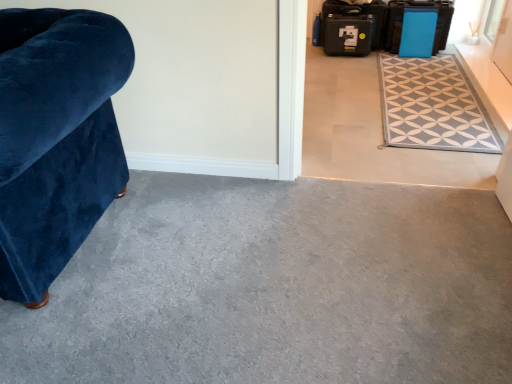
In order to face blue matte suitcase at upper right, which is the 2th luggage from left to right, should I rotate leftwards or rightwards?

You should look right and rotate roughly 20.894 degrees.

Describe the element at coordinates (418, 32) in the screenshot. I see `blue matte suitcase at upper right, which is the 2th luggage from left to right` at that location.

Locate an element on the screen. The image size is (512, 384). velvet blue armchair at left is located at coordinates (56, 139).

Describe the element at coordinates (56, 139) in the screenshot. I see `velvet blue armchair at left` at that location.

Image resolution: width=512 pixels, height=384 pixels. What do you see at coordinates (347, 34) in the screenshot?
I see `black plastic suitcase at upper right, the first luggage in the left-to-right sequence` at bounding box center [347, 34].

The image size is (512, 384). I want to click on gray carpet at lower left, which is counted as the 2th concrete, starting from the top, so click(276, 288).

This screenshot has width=512, height=384. Find the location of `gray tile floor at center, the 2th concrete in the front-to-back sequence`. gray tile floor at center, the 2th concrete in the front-to-back sequence is located at coordinates (369, 130).

This screenshot has width=512, height=384. What do you see at coordinates (369, 130) in the screenshot?
I see `gray tile floor at center, the 1th concrete from the back` at bounding box center [369, 130].

Locate an element on the screen. This screenshot has width=512, height=384. blue matte suitcase at upper right, placed as the second luggage when sorted from right to left is located at coordinates (418, 32).

Who is taller, blue matte suitcase at upper right, which is the 2th luggage from left to right, or gray tile floor at center, the 1th concrete from the back?

Standing taller between the two is blue matte suitcase at upper right, which is the 2th luggage from left to right.

From the image's perspective, is blue matte suitcase at upper right, placed as the second luggage when sorted from right to left, over gray tile floor at center, placed as the 1th concrete when sorted from top to bottom?

Correct, blue matte suitcase at upper right, placed as the second luggage when sorted from right to left, appears higher than gray tile floor at center, placed as the 1th concrete when sorted from top to bottom, in the image.

Considering the relative positions of blue matte suitcase at upper right, placed as the second luggage when sorted from right to left, and gray tile floor at center, placed as the 1th concrete when sorted from top to bottom, in the image provided, is blue matte suitcase at upper right, placed as the second luggage when sorted from right to left, behind gray tile floor at center, placed as the 1th concrete when sorted from top to bottom,?

Yes, it is behind gray tile floor at center, placed as the 1th concrete when sorted from top to bottom.

In the scene shown: How different are the orientations of black plastic suitcase at upper right, the first luggage in the left-to-right sequence, and blue matte suitcase at upper right, which is the 2th luggage from left to right, in degrees?

They differ by 0.978 degrees in their facing directions.

Is point (342, 27) positioned after point (407, 7)?

Yes.

Is black plastic suitcase at upper right, which is the 3th luggage from right to left, turned away from blue matte suitcase at upper right, which is the 2th luggage from left to right?

No, blue matte suitcase at upper right, which is the 2th luggage from left to right, is not at the back of black plastic suitcase at upper right, which is the 3th luggage from right to left.

Considering the relative positions of black plastic suitcase at upper right, the first luggage in the left-to-right sequence, and blue matte suitcase at upper right, placed as the second luggage when sorted from right to left, in the image provided, is black plastic suitcase at upper right, the first luggage in the left-to-right sequence, to the left or to the right of blue matte suitcase at upper right, placed as the second luggage when sorted from right to left,?

black plastic suitcase at upper right, the first luggage in the left-to-right sequence, is positioned on blue matte suitcase at upper right, placed as the second luggage when sorted from right to left,'s left side.

Can you tell me how much gray carpet at lower left, which appears as the 2th concrete when viewed from the back, and velvet blue armchair at left differ in facing direction?

They differ by 180 degrees in their facing directions.

From a real-world perspective, between gray carpet at lower left, which is counted as the 2th concrete, starting from the top, and velvet blue armchair at left, who is vertically lower?

gray carpet at lower left, which is counted as the 2th concrete, starting from the top.

Are gray carpet at lower left, which is counted as the 1th concrete, starting from the bottom, and velvet blue armchair at left located far from each other?

They are positioned close to each other.

Is the depth of gray carpet at lower left, which is counted as the 1th concrete, starting from the bottom, less than that of velvet blue armchair at left?

That is False.

Is gray tile floor at center, the 1th concrete from the back, not near black plastic suitcase at upper right, the first luggage in the left-to-right sequence?

No, gray tile floor at center, the 1th concrete from the back, is in close proximity to black plastic suitcase at upper right, the first luggage in the left-to-right sequence.

Based on their sizes in the image, would you say gray tile floor at center, the 2th concrete in the front-to-back sequence, is bigger or smaller than black plastic suitcase at upper right, which is the 3th luggage from right to left?

Clearly, gray tile floor at center, the 2th concrete in the front-to-back sequence, is larger in size than black plastic suitcase at upper right, which is the 3th luggage from right to left.

Visually, is gray tile floor at center, the 1th concrete from the back, positioned to the left or to the right of black plastic suitcase at upper right, which is the 3th luggage from right to left?

From the image, it's evident that gray tile floor at center, the 1th concrete from the back, is to the right of black plastic suitcase at upper right, which is the 3th luggage from right to left.

From the image's perspective, is gray tile floor at center, the 2th concrete in the front-to-back sequence, over black plastic suitcase at upper right, the first luggage in the left-to-right sequence?

No.

From the image's perspective, does black plastic suitcase at upper right, the first luggage in the left-to-right sequence, appear higher than gray fabric rug at upper right?

Yes, from the image's perspective, black plastic suitcase at upper right, the first luggage in the left-to-right sequence, is on top of gray fabric rug at upper right.

Is black plastic suitcase at upper right, which is the 3th luggage from right to left, positioned beyond the bounds of gray fabric rug at upper right?

Indeed, black plastic suitcase at upper right, which is the 3th luggage from right to left, is completely outside gray fabric rug at upper right.

Can you tell me how much black plastic suitcase at upper right, which is the 3th luggage from right to left, and gray fabric rug at upper right differ in facing direction?

They differ by 89.8 degrees in their facing directions.

Can you see black plastic suitcase at upper right, which is the 3th luggage from right to left, touching gray fabric rug at upper right?

No, black plastic suitcase at upper right, which is the 3th luggage from right to left, is not making contact with gray fabric rug at upper right.

Which object is further away from the camera, gray carpet at lower left, which appears as the 2th concrete when viewed from the back, or gray fabric rug at upper right?

gray fabric rug at upper right is further from the camera.

Is gray carpet at lower left, which is counted as the 2th concrete, starting from the top, turned away from gray fabric rug at upper right?

No, gray fabric rug at upper right is not at the back of gray carpet at lower left, which is counted as the 2th concrete, starting from the top.

From a real-world perspective, who is located higher, gray carpet at lower left, which appears as the 2th concrete when viewed from the back, or gray fabric rug at upper right?

From a 3D spatial view, gray fabric rug at upper right is above.

Considering the relative sizes of gray carpet at lower left, the first concrete viewed from the front, and gray fabric rug at upper right in the image provided, is gray carpet at lower left, the first concrete viewed from the front, taller than gray fabric rug at upper right?

Correct, gray carpet at lower left, the first concrete viewed from the front, is much taller as gray fabric rug at upper right.

Which luggage is the 1st one when counting from the back of the blue matte suitcase at upper right, placed as the second luggage when sorted from right to left? Please provide its 2D coordinates.

[(402, 22)]

Considering the sizes of objects blue matte suitcase at upper right, which is the 2th luggage from left to right, and blue plastic suitcase at upper right, positioned as the 1th luggage in right-to-left order, in the image provided, who is wider, blue matte suitcase at upper right, which is the 2th luggage from left to right, or blue plastic suitcase at upper right, positioned as the 1th luggage in right-to-left order,?

With larger width is blue plastic suitcase at upper right, positioned as the 1th luggage in right-to-left order.

From the image's perspective, between blue matte suitcase at upper right, placed as the second luggage when sorted from right to left, and blue plastic suitcase at upper right, positioned as the 1th luggage in right-to-left order, which one is located above?

blue plastic suitcase at upper right, positioned as the 1th luggage in right-to-left order.

Consider the image. Would you say blue matte suitcase at upper right, placed as the second luggage when sorted from right to left, is inside or outside blue plastic suitcase at upper right, placed as the 3th luggage when sorted from left to right?

blue matte suitcase at upper right, placed as the second luggage when sorted from right to left, is not enclosed by blue plastic suitcase at upper right, placed as the 3th luggage when sorted from left to right.

Where is `the 1st luggage above the gray tile floor at center, placed as the 1th concrete when sorted from top to bottom (from the image's perspective)`? the 1st luggage above the gray tile floor at center, placed as the 1th concrete when sorted from top to bottom (from the image's perspective) is located at coordinates (418, 32).

You are a GUI agent. You are given a task and a screenshot of the screen. Output one action in this format:
    pyautogui.click(x=<x>, y=<y>)
    Task: Click on the luggage on the left of the blue matte suitcase at upper right, which is the 2th luggage from left to right
    
    Given the screenshot: What is the action you would take?
    pyautogui.click(x=347, y=34)

Estimate the real-world distances between objects in this image. Which object is further from blue matte suitcase at upper right, which is the 2th luggage from left to right, gray tile floor at center, the 2th concrete in the front-to-back sequence, or velvet blue armchair at left?

velvet blue armchair at left is further to blue matte suitcase at upper right, which is the 2th luggage from left to right.

From the image, which object appears to be farther from gray fabric rug at upper right, blue plastic suitcase at upper right, placed as the 3th luggage when sorted from left to right, or blue matte suitcase at upper right, placed as the second luggage when sorted from right to left?

blue plastic suitcase at upper right, placed as the 3th luggage when sorted from left to right.

When comparing their distances from blue matte suitcase at upper right, which is the 2th luggage from left to right, does velvet blue armchair at left or gray fabric rug at upper right seem closer?

Based on the image, gray fabric rug at upper right appears to be nearer to blue matte suitcase at upper right, which is the 2th luggage from left to right.

Considering their positions, is gray carpet at lower left, which is counted as the 2th concrete, starting from the top, positioned closer to gray fabric rug at upper right than blue matte suitcase at upper right, which is the 2th luggage from left to right?

blue matte suitcase at upper right, which is the 2th luggage from left to right, is positioned closer to the anchor gray fabric rug at upper right.

Which object lies nearer to the anchor point gray carpet at lower left, which appears as the 2th concrete when viewed from the back, gray fabric rug at upper right or blue plastic suitcase at upper right, placed as the 3th luggage when sorted from left to right?

Among the two, gray fabric rug at upper right is located nearer to gray carpet at lower left, which appears as the 2th concrete when viewed from the back.

Based on their spatial positions, is gray tile floor at center, placed as the 1th concrete when sorted from top to bottom, or gray carpet at lower left, which is counted as the 2th concrete, starting from the top, further from blue plastic suitcase at upper right, placed as the 3th luggage when sorted from left to right?

gray carpet at lower left, which is counted as the 2th concrete, starting from the top, lies further to blue plastic suitcase at upper right, placed as the 3th luggage when sorted from left to right, than the other object.

Based on their spatial positions, is gray fabric rug at upper right or blue plastic suitcase at upper right, placed as the 3th luggage when sorted from left to right, further from black plastic suitcase at upper right, which is the 3th luggage from right to left?

gray fabric rug at upper right lies further to black plastic suitcase at upper right, which is the 3th luggage from right to left, than the other object.

Estimate the real-world distances between objects in this image. Which object is closer to velvet blue armchair at left, black plastic suitcase at upper right, which is the 3th luggage from right to left, or gray fabric rug at upper right?

gray fabric rug at upper right lies closer to velvet blue armchair at left than the other object.

Where is `luggage positioned between gray tile floor at center, the second concrete when ordered from bottom to top, and blue plastic suitcase at upper right, placed as the 3th luggage when sorted from left to right, from near to far`? luggage positioned between gray tile floor at center, the second concrete when ordered from bottom to top, and blue plastic suitcase at upper right, placed as the 3th luggage when sorted from left to right, from near to far is located at coordinates (418, 32).

Locate an element on the screen. The height and width of the screenshot is (384, 512). luggage between gray fabric rug at upper right and blue plastic suitcase at upper right, positioned as the 1th luggage in right-to-left order, along the z-axis is located at coordinates (418, 32).

Identify the location of mat located between gray tile floor at center, the 1th concrete from the back, and blue plastic suitcase at upper right, placed as the 3th luggage when sorted from left to right, in the depth direction. This screenshot has height=384, width=512. (433, 106).

I want to click on mat between gray carpet at lower left, which is counted as the 2th concrete, starting from the top, and black plastic suitcase at upper right, which is the 3th luggage from right to left, in the front-back direction, so click(433, 106).